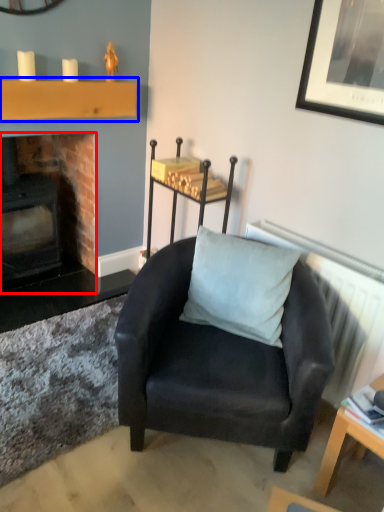
Question: Among these objects, which one is nearest to the camera, fireplace (highlighted by a red box) or shelf (highlighted by a blue box)?

Choices:
 (A) fireplace
 (B) shelf

Answer: (B)